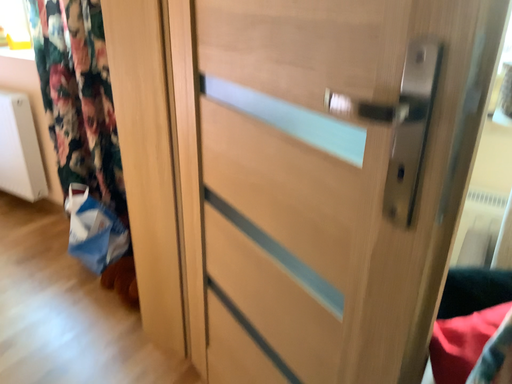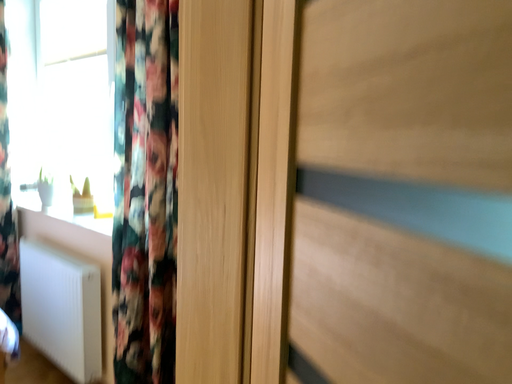
Question: How did the camera likely rotate when shooting the video?

Choices:
 (A) rotated left
 (B) rotated right

Answer: (A)